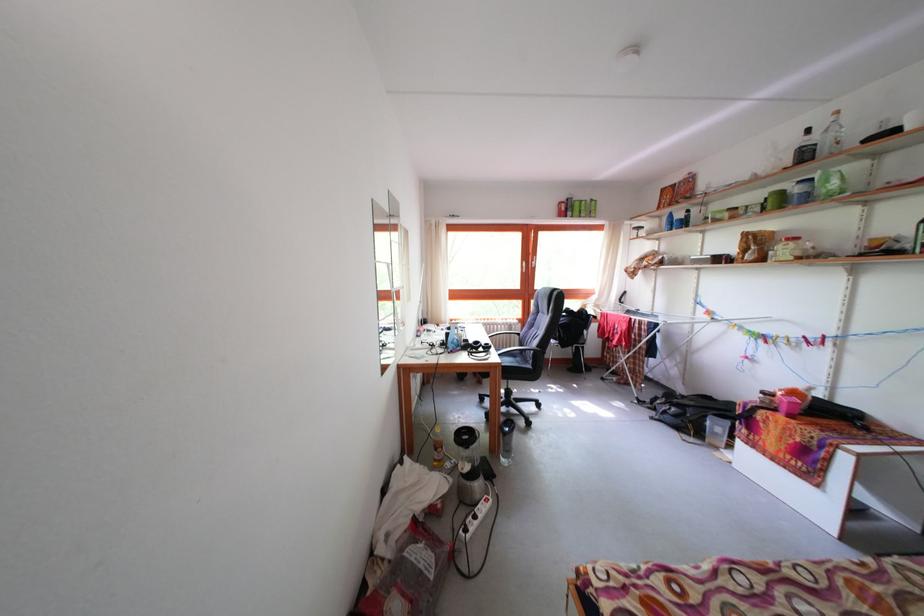
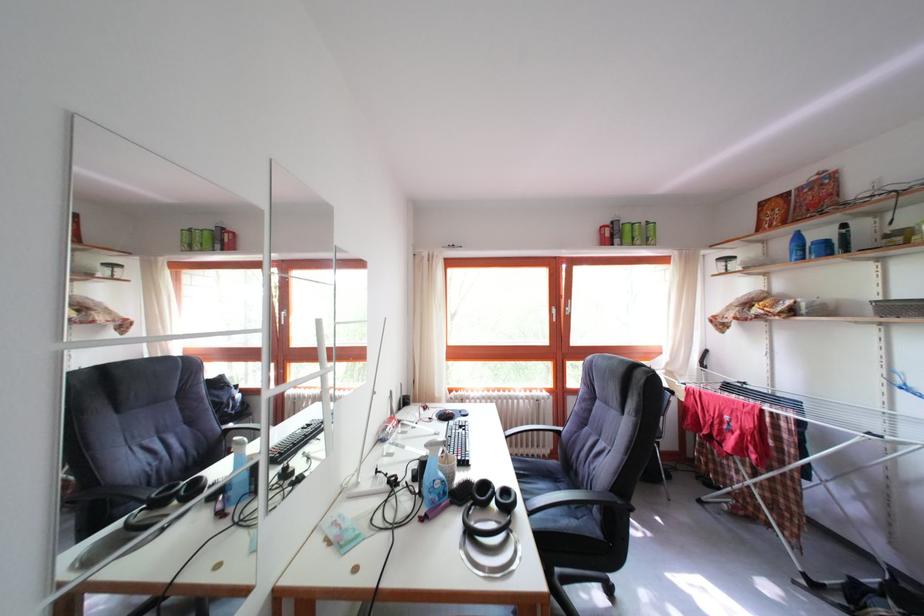
Question: What movement of the cameraman would produce the second image?

Choices:
 (A) Left
 (B) Right
 (C) Forward
 (D) Backward

Answer: (C)